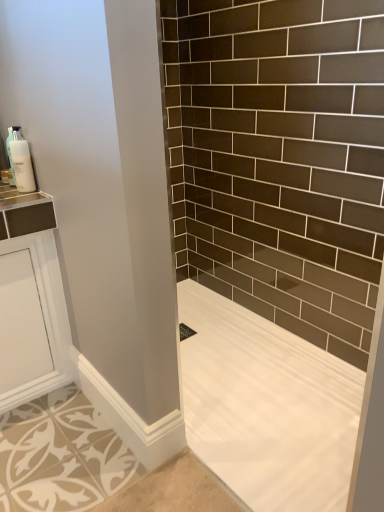
This screenshot has width=384, height=512. I want to click on free space above white smooth bathtub at lower right (from a real-world perspective), so click(205, 402).